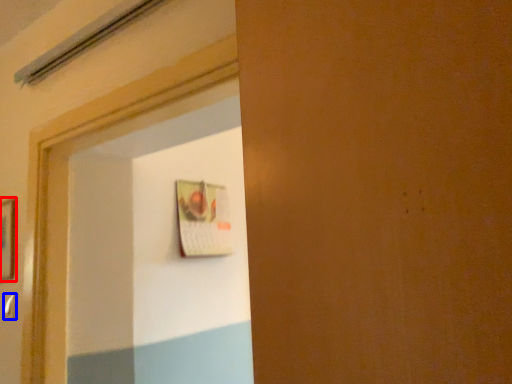
Question: Which object is closer to the camera taking this photo, picture frame (highlighted by a red box) or door handle (highlighted by a blue box)?

Choices:
 (A) picture frame
 (B) door handle

Answer: (B)